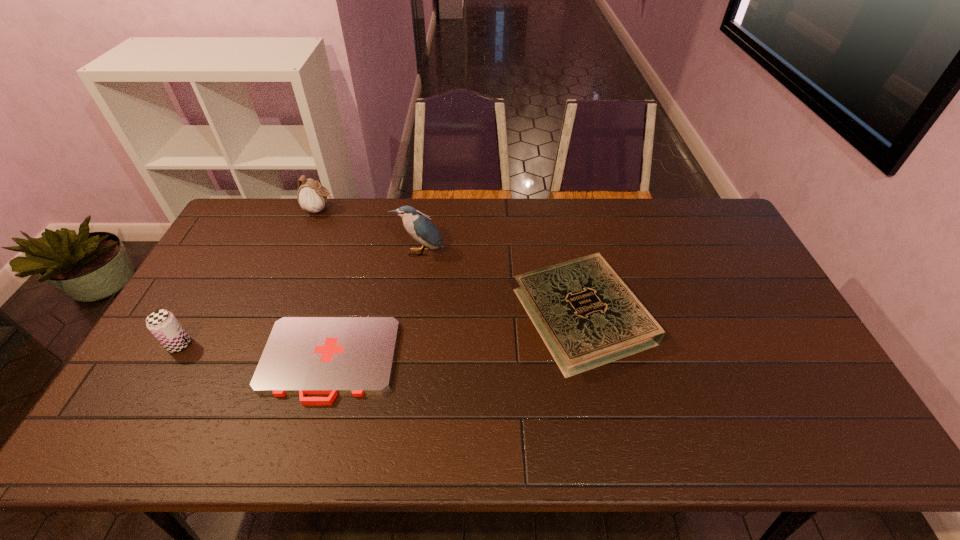
Where is `free region located 0.230m on the back of the rightmost object`? The image size is (960, 540). free region located 0.230m on the back of the rightmost object is located at coordinates (563, 221).

Identify the location of vacant space located 0.070m on handle side the first-aid kit. (309, 433).

Locate an element on the screen. The height and width of the screenshot is (540, 960). object located in the far edge section of the desktop is located at coordinates tap(311, 196).

Where is `object that is at the left edge`? Image resolution: width=960 pixels, height=540 pixels. object that is at the left edge is located at coordinates (164, 326).

Image resolution: width=960 pixels, height=540 pixels. Identify the location of free region at the far edge of the desktop. (349, 214).

You are a GUI agent. You are given a task and a screenshot of the screen. Output one action in this format:
    pyautogui.click(x=<x>, y=<y>)
    Task: Click on the vacant region at the near edge
    
    Given the screenshot: What is the action you would take?
    pyautogui.click(x=676, y=430)

At what (x,y) coordinates should I click in order to perform the action: click on vacant region at the left edge. Please return your answer as a coordinate pair (x, y). The width and height of the screenshot is (960, 540). Looking at the image, I should click on (236, 260).

The image size is (960, 540). Find the location of `vacant space at the right edge`. vacant space at the right edge is located at coordinates (746, 321).

Locate an element on the screen. Image resolution: width=960 pixels, height=540 pixels. free space at the far left corner of the desktop is located at coordinates (261, 202).

You are a GUI agent. You are given a task and a screenshot of the screen. Output one action in this format:
    pyautogui.click(x=<x>, y=<y>)
    Task: Click on the free spot between the farthest object and the beer can
    This screenshot has height=540, width=960.
    Given the screenshot: What is the action you would take?
    pyautogui.click(x=250, y=277)